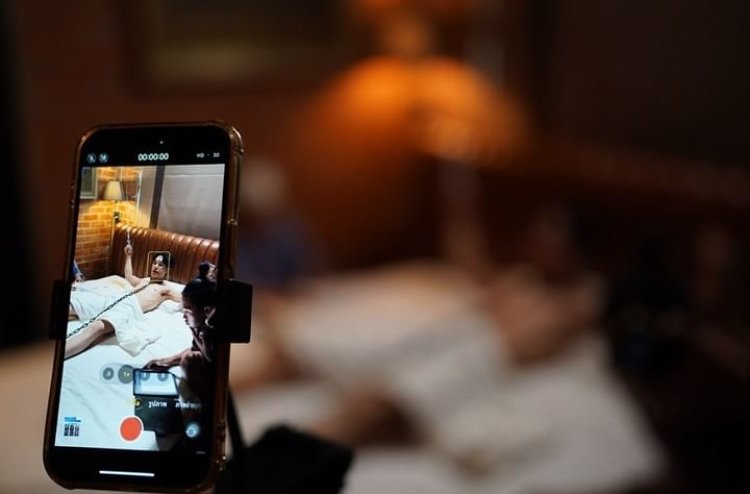
Locate an element on the screen. The image size is (750, 494). bed is located at coordinates (78, 383), (530, 446).